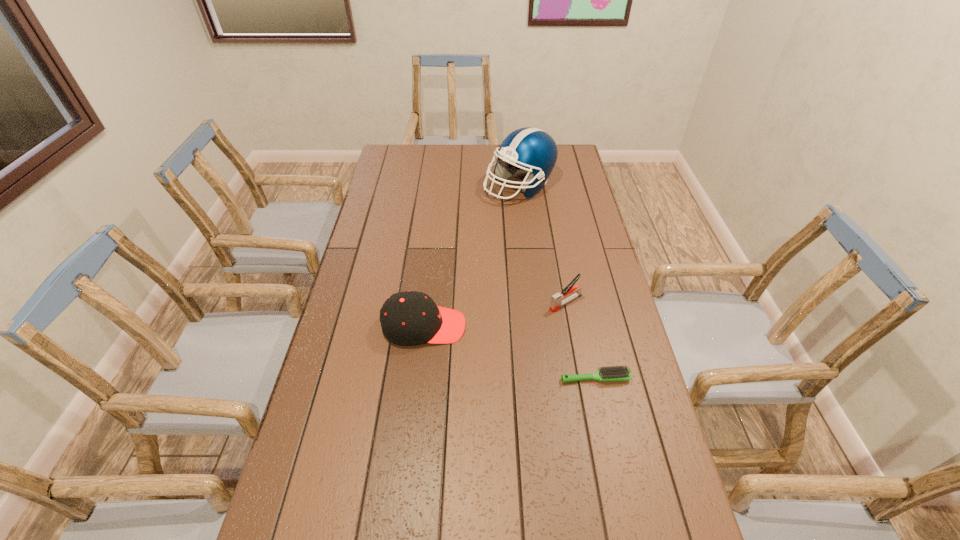
At what (x,y) coordinates should I click in order to perform the action: click on the leftmost object. Please return your answer as a coordinate pair (x, y). Looking at the image, I should click on (407, 318).

This screenshot has height=540, width=960. Identify the location of hairbrush. (617, 373).

Identify the location of the nearest object. (617, 373).

Locate an element on the screen. The height and width of the screenshot is (540, 960). stapler is located at coordinates (558, 300).

I want to click on the farthest object, so click(x=529, y=149).

Where is `the tallest object`? the tallest object is located at coordinates (529, 149).

Locate an element on the screen. blank space located on the front-facing side of the cap is located at coordinates (498, 326).

You are a GUI agent. You are given a task and a screenshot of the screen. Output one action in this format:
    pyautogui.click(x=<x>, y=<y>)
    Task: Click on the free space located 0.220m on the front of the nearest object
    The image size is (960, 540).
    Given the screenshot: What is the action you would take?
    pyautogui.click(x=614, y=466)

Find the location of `free point located on the handle side of the stapler`. free point located on the handle side of the stapler is located at coordinates (540, 315).

The image size is (960, 540). I want to click on free space located 0.320m on the handle side of the stapler, so click(x=468, y=356).